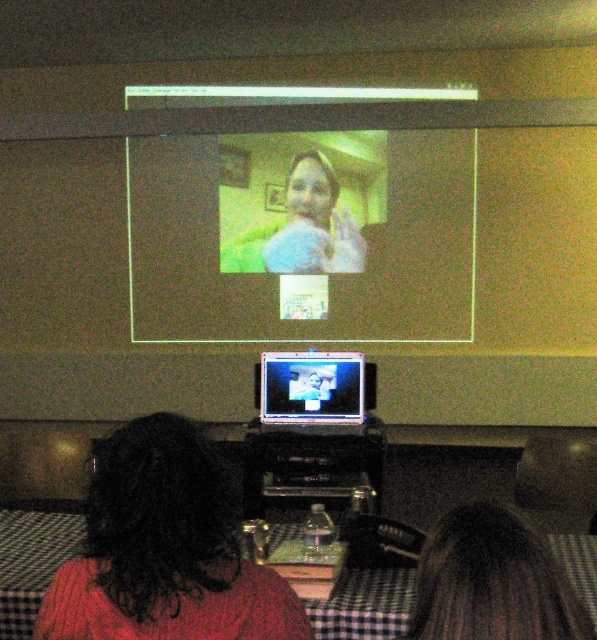
Question: Where is dark brown hair at lower left located in relation to dark brown hair at lower right in the image?

Choices:
 (A) left
 (B) right

Answer: (A)

Question: Which of these objects is positioned farthest from the matte plastic screen at upper center?

Choices:
 (A) dark brown hair at lower left
 (B) shiny silver laptop at center

Answer: (A)

Question: Is dark brown hair at lower left to the left of dark brown hair at lower right from the viewer's perspective?

Choices:
 (A) no
 (B) yes

Answer: (B)

Question: Among these objects, which one is nearest to the camera?

Choices:
 (A) shiny silver laptop at center
 (B) matte plastic screen at upper center
 (C) dark brown hair at lower right
 (D) dark brown hair at lower left

Answer: (C)

Question: Which point is closer to the camera?

Choices:
 (A) matte plastic screen at upper center
 (B) dark brown hair at lower right

Answer: (B)

Question: From the image, what is the correct spatial relationship of dark brown hair at lower left in relation to dark brown hair at lower right?

Choices:
 (A) below
 (B) above

Answer: (A)